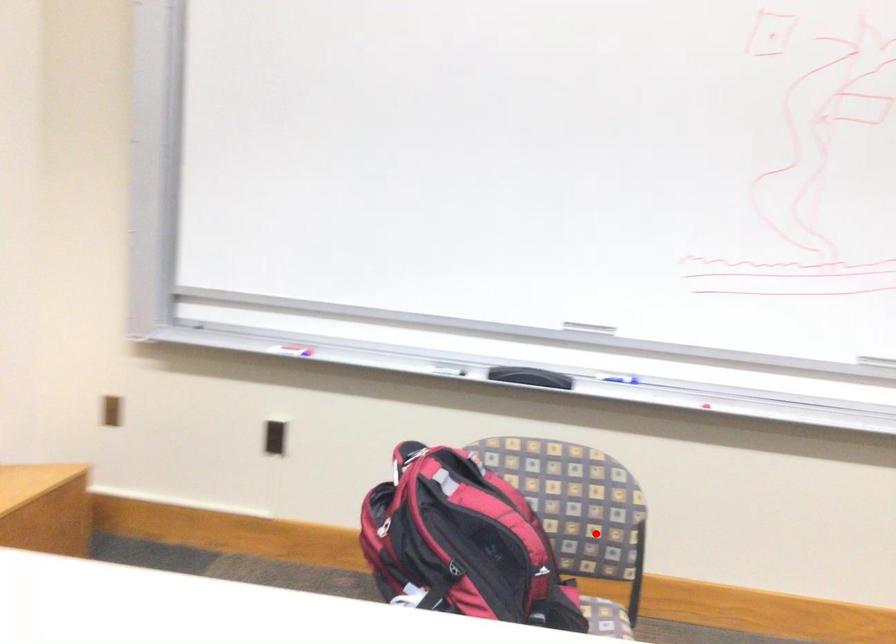
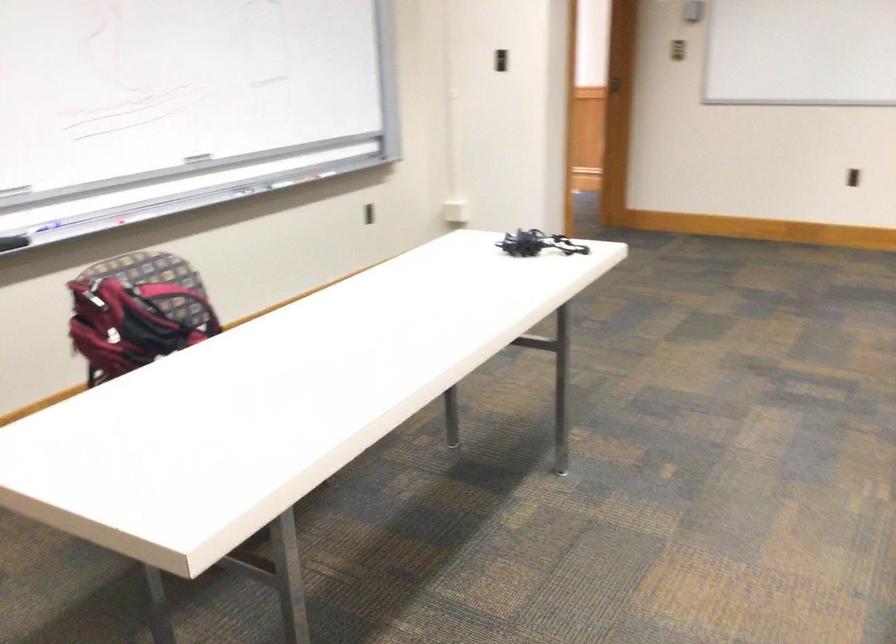
Question: A red point is marked in image1. In image2, is the corresponding 3D point closer to the camera or farther? Reply with the corresponding letter.

Choices:
 (A) The corresponding 3D point is closer.
 (B) The corresponding 3D point is farther.

Answer: (B)